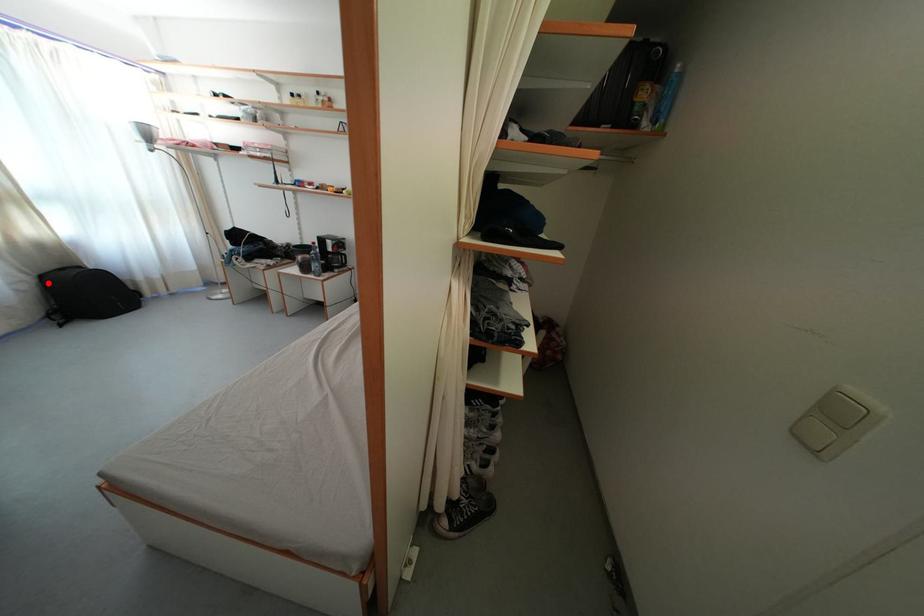
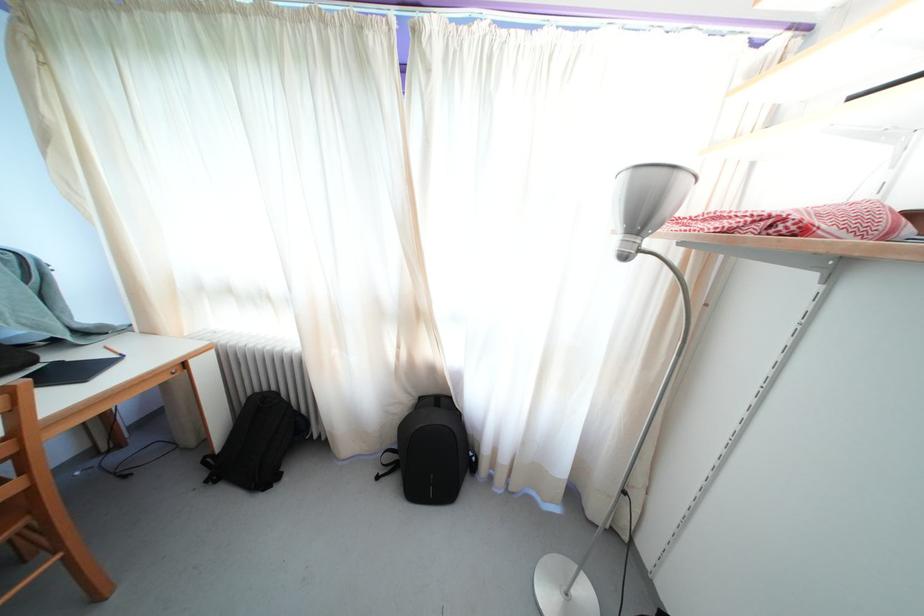
Find the pixel in the second image that matches the highlighted location in the first image.

(427, 405)